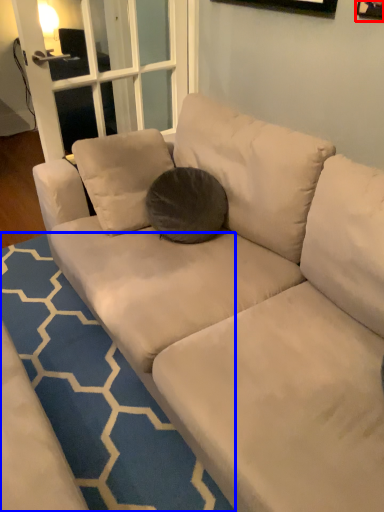
Question: Which point is closer to the camera, picture frame (highlighted by a red box) or doormat (highlighted by a blue box)?

Choices:
 (A) picture frame
 (B) doormat

Answer: (B)